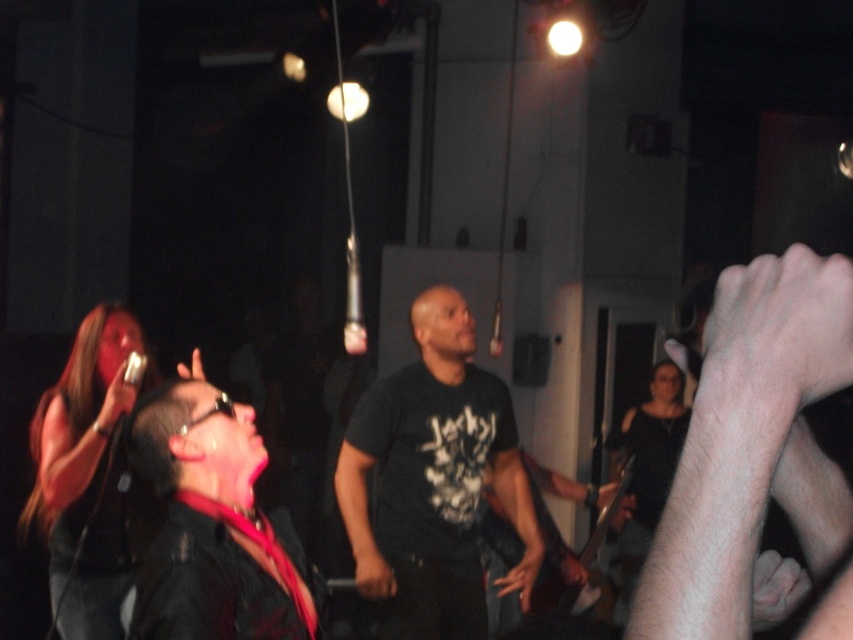
Question: Which point appears farthest from the camera in this image?

Choices:
 (A) (364, 547)
 (B) (218, 508)

Answer: (A)

Question: Does black matte t-shirt at center appear over black leather jacket at lower left?

Choices:
 (A) yes
 (B) no

Answer: (B)

Question: Is black matte t-shirt at center above black leather jacket at lower left?

Choices:
 (A) no
 (B) yes

Answer: (A)

Question: Is black matte t-shirt at center positioned before black leather jacket at lower left?

Choices:
 (A) no
 (B) yes

Answer: (A)